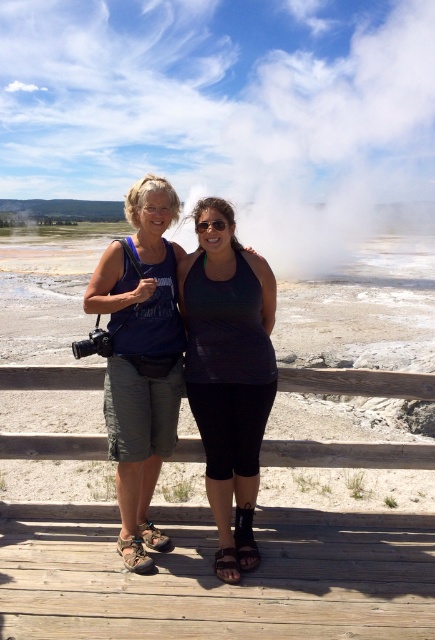
You are a photographer trying to capture the white vapor at center and the matte blue tank top at center in a single shot. Which object should you focus on first to ensure both are in focus?

You should focus on the matte blue tank top at center first because it is closer to you than the white vapor at center, which is further away. By focusing on the closer object, the depth of field may still capture the distant vapor in focus.

You are a photographer trying to capture a closeup of the steam rising from the geothermal area in the background. You have a matte blue tank top at center and a black matte sunglasses at center in your viewfinder. Which object should you adjust your focus to ensure the steam is in focus, considering their sizes?

The matte blue tank top at center has a larger size compared to the black matte sunglasses at center, so you should focus on the matte blue tank top at center to ensure the steam in the background is in focus.

You are a photographer trying to capture the scene of the two people on the wooden platform at the tourist attraction. You notice a point at coordinates (x=140, y=356) in the image. Based on the description, can you identify what object this point is located on?

The point at coordinates (x=140, y=356) is located on the matte blue tank top at center.